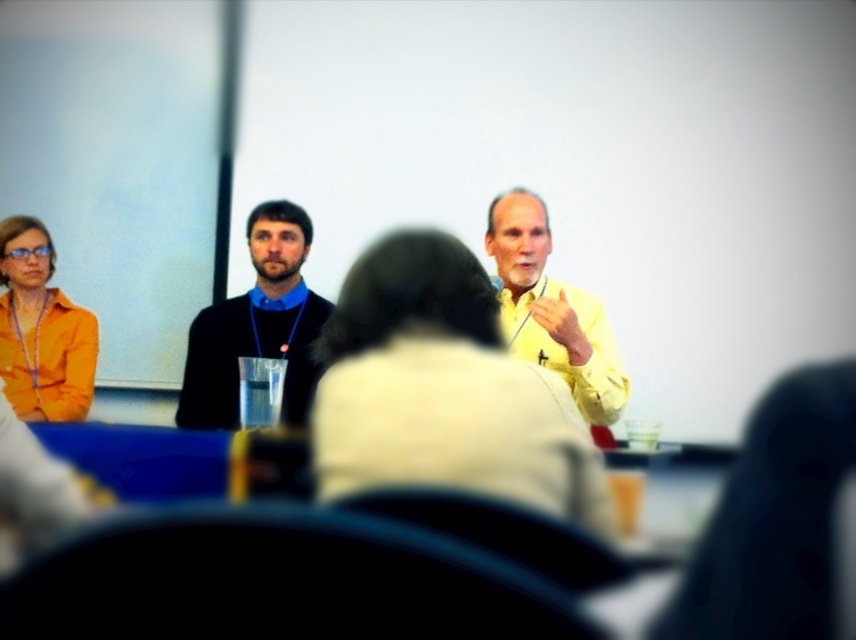
Question: Which object is the farthest from the yellow matte shirt at center?

Choices:
 (A) black matte sweater at center
 (B) orange matte shirt at left

Answer: (B)

Question: In this image, where is black matte sweater at center located relative to orange matte shirt at left?

Choices:
 (A) right
 (B) left

Answer: (A)

Question: Can you confirm if yellow matte shirt at center is positioned to the right of orange matte shirt at left?

Choices:
 (A) no
 (B) yes

Answer: (B)

Question: Is black matte sweater at center positioned at the back of orange matte shirt at left?

Choices:
 (A) yes
 (B) no

Answer: (B)

Question: Which point appears closest to the camera in this image?

Choices:
 (A) (536, 225)
 (B) (302, 410)
 (C) (70, 314)

Answer: (A)

Question: Which is farther from the orange matte shirt at left?

Choices:
 (A) yellow matte shirt at center
 (B) black matte sweater at center

Answer: (A)